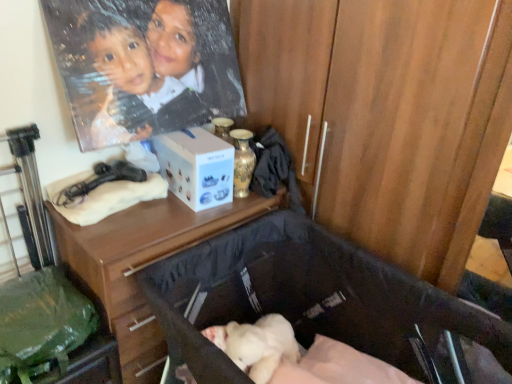
Question: From the image's perspective, is matte black hairdryer at upper left above or below white matte box at center?

Choices:
 (A) below
 (B) above

Answer: (A)

Question: Considering the positions of matte black hairdryer at upper left and white matte box at center in the image, is matte black hairdryer at upper left wider or thinner than white matte box at center?

Choices:
 (A) wide
 (B) thin

Answer: (B)

Question: Which object is positioned closest to the soft black fabric baby carriage at lower center?

Choices:
 (A) white matte box at center
 (B) gold metallic vase at upper center
 (C) green fabric bag at lower left
 (D) matte black hairdryer at upper left
 (E) wooden desk at center

Answer: (E)

Question: Estimate the real-world distances between objects in this image. Which object is farther from the green fabric bag at lower left?

Choices:
 (A) gold metallic vase at upper center
 (B) matte black hairdryer at upper left
 (C) wooden desk at center
 (D) soft black fabric baby carriage at lower center
 (E) white matte box at center

Answer: (A)